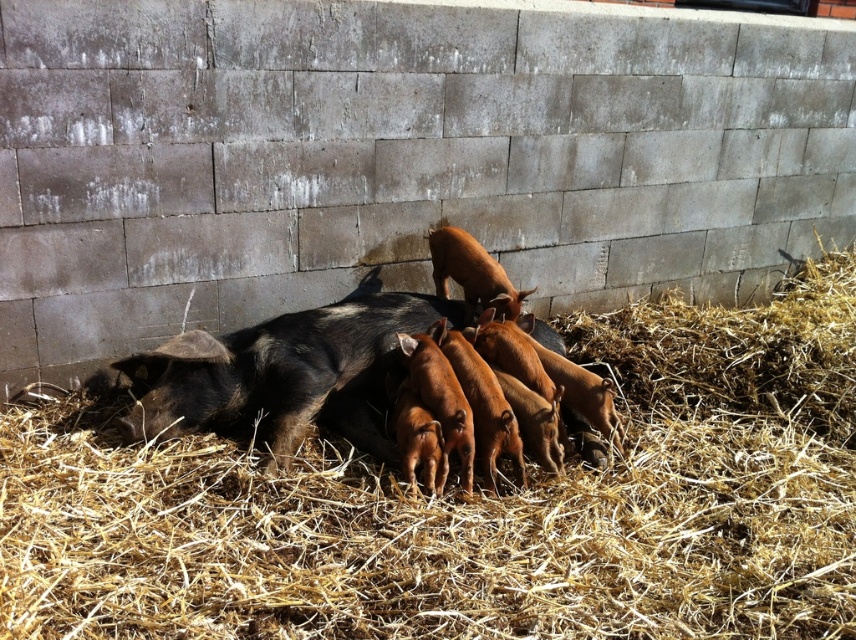
Is brown straw at center shorter than shiny black sow at center?

In fact, brown straw at center may be taller than shiny black sow at center.

Based on the photo, does brown straw at center come in front of shiny black sow at center?

Yes, brown straw at center is closer to the viewer.

Between point (372, 538) and point (334, 396), which one is positioned in front?

Point (372, 538) is in front.

Where is `brown straw at center`? This screenshot has height=640, width=856. brown straw at center is located at coordinates (474, 506).

Is shiny black sow with reddish-brown piglets at center closer to camera compared to shiny black sow at center?

That is True.

Does point (212, 349) lie in front of point (179, 344)?

That is False.

Which is behind, point (470, 444) or point (300, 413)?

The point (300, 413) is behind.

Where is `shiny black sow with reddish-brown piglets at center`? This screenshot has width=856, height=640. shiny black sow with reddish-brown piglets at center is located at coordinates (284, 374).

Is brown straw at center positioned behind shiny black sow with reddish-brown piglets at center?

No, brown straw at center is in front of shiny black sow with reddish-brown piglets at center.

Locate an element on the screen. The width and height of the screenshot is (856, 640). brown straw at center is located at coordinates (474, 506).